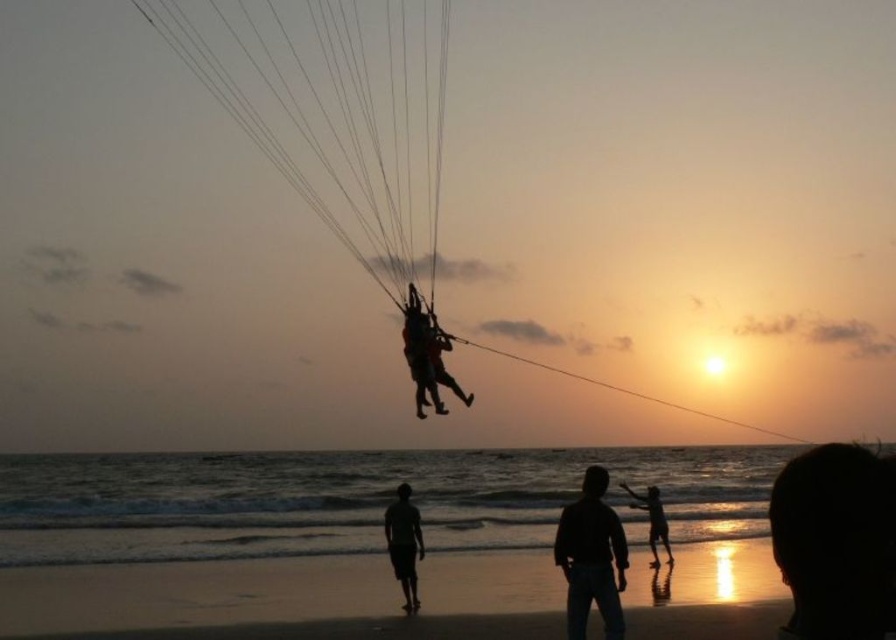
You are a photographer trying to capture the sunset scene. You notice the silhouette jeans at lower center and the silhouette sand at lower right. Which object is located more to the left in the image?

The silhouette jeans at lower center is positioned on the left side of silhouette sand at lower right, so it is more to the left.

You are a photographer trying to capture the sunset scene. You notice the silhouette jeans at lower center and the silhouette sand at lower right. Which silhouette is wider?

The silhouette jeans at lower center is wider than the silhouette sand at lower right.